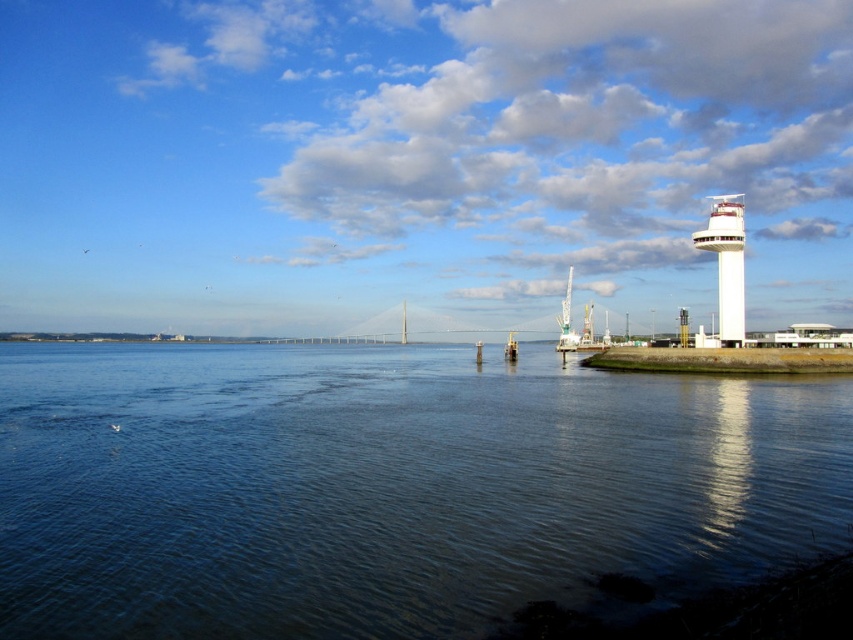
You are a photographer planning to capture the waterfront scene. You want to ensure that the dark blue water at center and the white smooth tower at right are both visible in your shot. Given that your camera has a fixed focal length, which object should you position closer to the edge of the frame to include both?

Since the dark blue water at center has a larger width than the white smooth tower at right, you should position the white smooth tower at right closer to the edge of the frame to ensure both objects fit within the shot.

You are standing at the shoreline in the waterfront scene. You see two points marked in the image. The first point is at coordinate point (345, 563), and the second is at coordinate point (735, 241). Which point is closer to you?

Point (345, 563) is in front of point (735, 241), so the first point is closer to you.